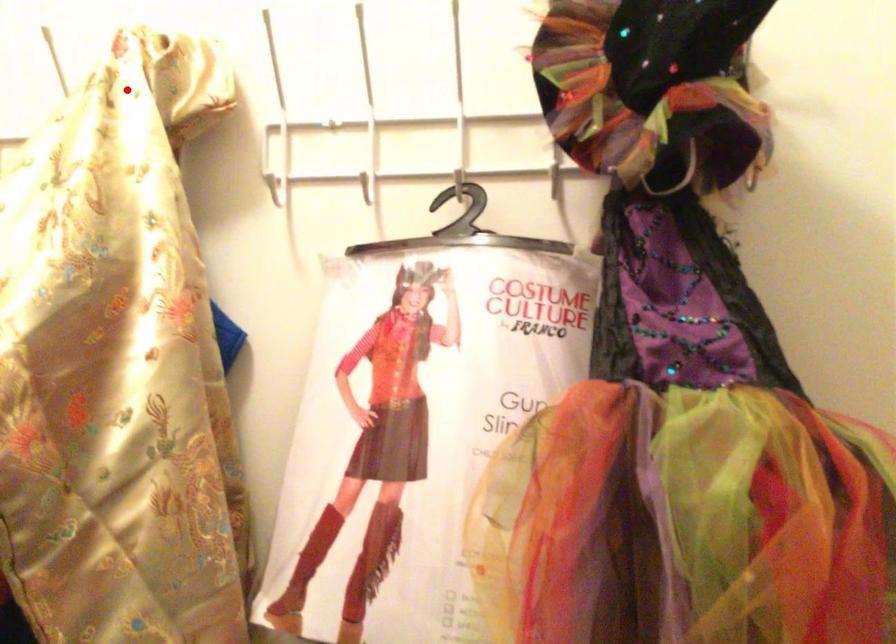
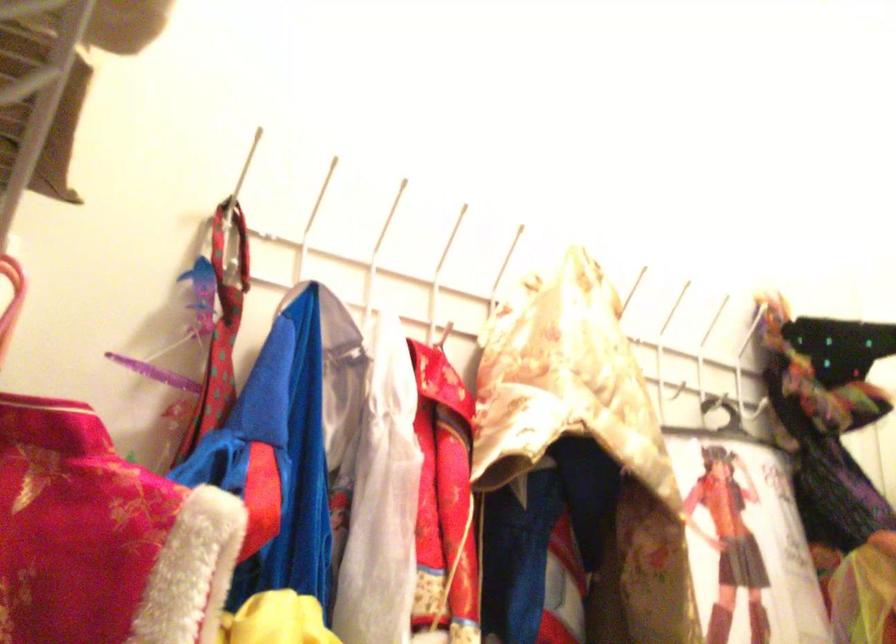
Question: I am providing you with two images of the same scene from different viewpoints. Image1 has a red point marked. In image2, the corresponding 3D location appears at what relative position? Reply with the corresponding letter.

Choices:
 (A) Closer
 (B) Farther

Answer: (B)